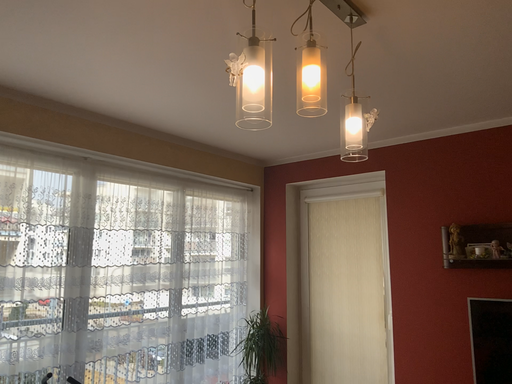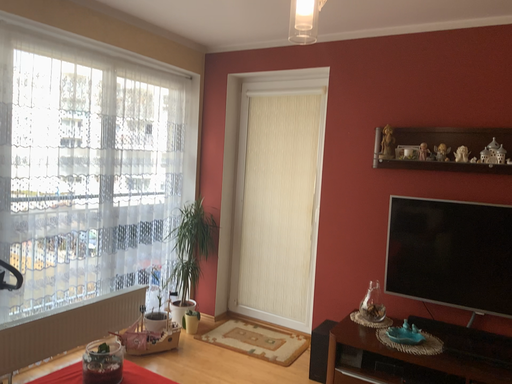
Question: Which way did the camera rotate in the video?

Choices:
 (A) rotated left
 (B) rotated right

Answer: (B)